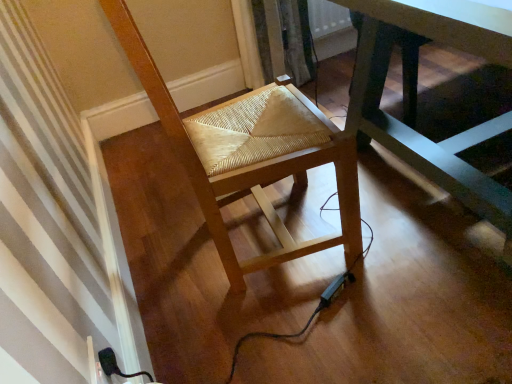
I want to click on free space below natural wood woven seat at center (from a real-world perspective), so click(267, 234).